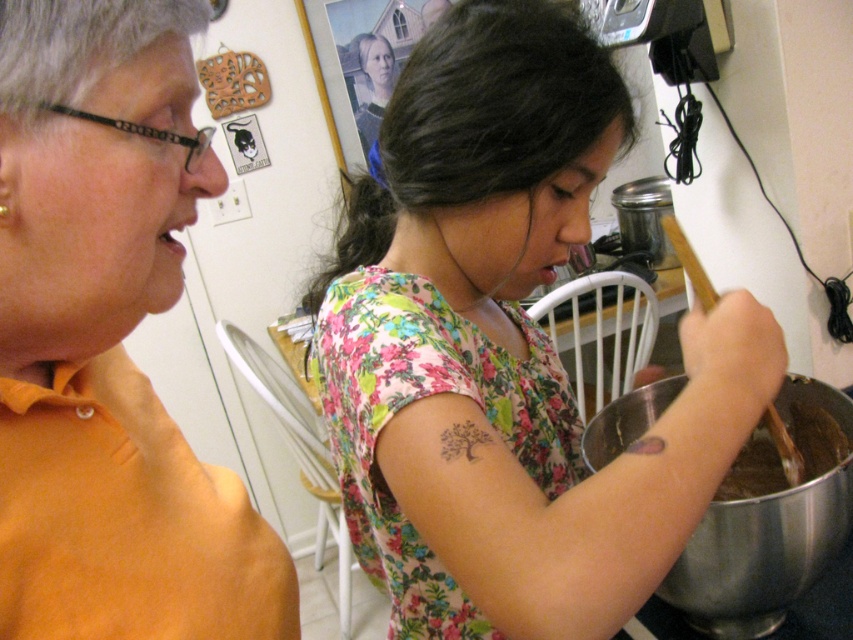
Is point (38, 163) positioned before point (612, 413)?

Yes, point (38, 163) is closer to viewer.

Can you confirm if orange matte shirt at left is shorter than metallic silver mixing bowl at lower right?

No, orange matte shirt at left is not shorter than metallic silver mixing bowl at lower right.

At what (x,y) coordinates should I click in order to perform the action: click on orange matte shirt at left. Please return your answer as a coordinate pair (x, y). Looking at the image, I should click on (109, 404).

Can you confirm if floral fabric shirt at center is wider than orange matte shirt at left?

Yes, floral fabric shirt at center is wider than orange matte shirt at left.

The image size is (853, 640). What do you see at coordinates (506, 349) in the screenshot? I see `floral fabric shirt at center` at bounding box center [506, 349].

Is point (363, 508) farther from viewer compared to point (149, 113)?

Yes, point (363, 508) is behind point (149, 113).

At what (x,y) coordinates should I click in order to perform the action: click on floral fabric shirt at center. Please return your answer as a coordinate pair (x, y). The width and height of the screenshot is (853, 640). Looking at the image, I should click on pos(506,349).

Can you confirm if floral fabric shirt at center is taller than metallic silver mixing bowl at lower right?

Correct, floral fabric shirt at center is much taller as metallic silver mixing bowl at lower right.

Who is shorter, floral fabric shirt at center or metallic silver mixing bowl at lower right?

With less height is metallic silver mixing bowl at lower right.

Measure the distance between floral fabric shirt at center and camera.

floral fabric shirt at center is 18.30 inches from camera.

Locate an element on the screen. The height and width of the screenshot is (640, 853). floral fabric shirt at center is located at coordinates (506, 349).